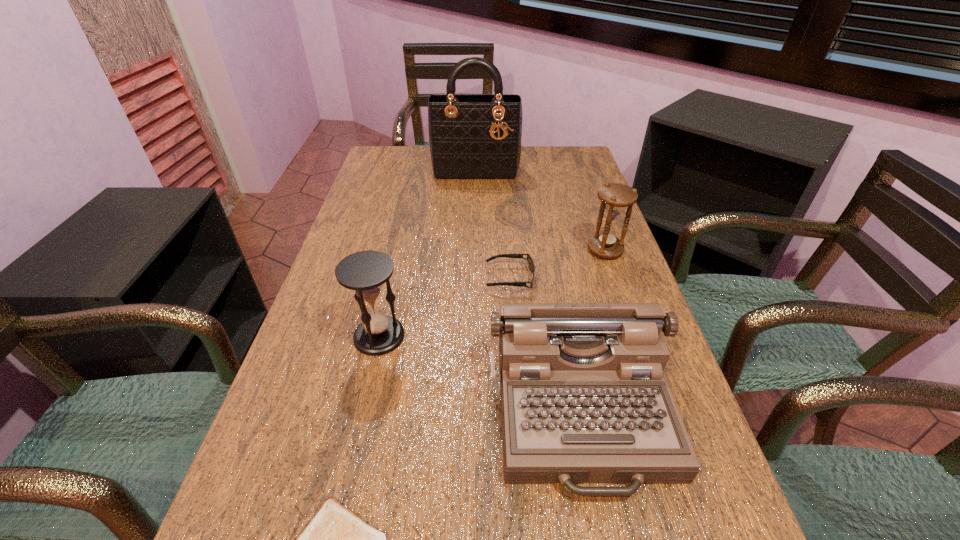
At what (x,y) coordinates should I click in order to perform the action: click on vacant point at the left edge. Please return your answer as a coordinate pair (x, y). Looking at the image, I should click on (383, 306).

Where is `free region at the right edge`? The width and height of the screenshot is (960, 540). free region at the right edge is located at coordinates (564, 244).

You are a GUI agent. You are given a task and a screenshot of the screen. Output one action in this format:
    pyautogui.click(x=<x>, y=<y>)
    Task: Click on the free spot at the far left corner of the desktop
    The height and width of the screenshot is (540, 960).
    Given the screenshot: What is the action you would take?
    pyautogui.click(x=408, y=164)

Locate an element on the screen. This screenshot has width=960, height=540. empty space that is in between the third farthest object and the left hourglass is located at coordinates (444, 307).

Find the location of a particular element. The width and height of the screenshot is (960, 540). vacant space in between the left hourglass and the sunglasses is located at coordinates (444, 307).

Where is `unoccupied position between the typewriter and the left hourglass`? The width and height of the screenshot is (960, 540). unoccupied position between the typewriter and the left hourglass is located at coordinates (481, 374).

Locate an element on the screen. vacant area between the fifth nearest object and the nearer hourglass is located at coordinates (492, 293).

What are the coordinates of `vacant space in between the farthest object and the sunglasses` in the screenshot? It's located at (492, 225).

The width and height of the screenshot is (960, 540). In order to click on free space between the fourth nearest object and the right hourglass in this screenshot , I will do `click(558, 264)`.

You are a GUI agent. You are given a task and a screenshot of the screen. Output one action in this format:
    pyautogui.click(x=<x>, y=<y>)
    Task: Click on the object that stands as the fourth closest to the toast
    Image resolution: width=960 pixels, height=540 pixels.
    Given the screenshot: What is the action you would take?
    pyautogui.click(x=615, y=197)